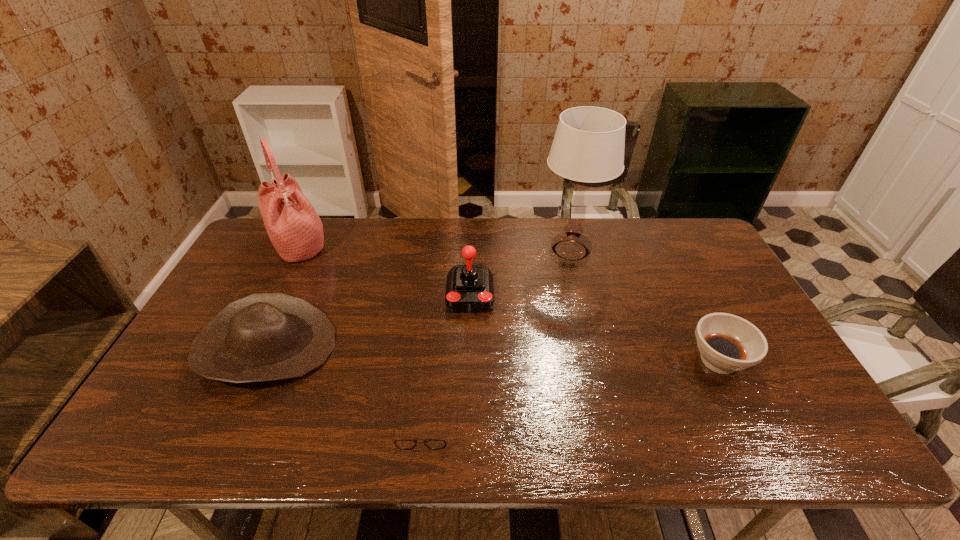
The width and height of the screenshot is (960, 540). I want to click on free spot between the sunglasses and the joystick, so click(447, 359).

This screenshot has width=960, height=540. Identify the location of free space between the rightmost object and the table lamp. (644, 305).

Find the location of a particular element. vacant area that lies between the cowboy hat and the rightmost object is located at coordinates (492, 354).

Where is `free area in between the third tallest object and the rightmost object`? free area in between the third tallest object and the rightmost object is located at coordinates pyautogui.click(x=594, y=328).

You are a GUI agent. You are given a task and a screenshot of the screen. Output one action in this format:
    pyautogui.click(x=<x>, y=<y>)
    Task: Click on the vacant space that is in between the sunglasses and the fourth tallest object
    
    Given the screenshot: What is the action you would take?
    pyautogui.click(x=346, y=384)

Find the location of a particular element. Image resolution: width=960 pixels, height=540 pixels. free spot between the joystick and the third shortest object is located at coordinates (369, 321).

At what (x,y) coordinates should I click in order to perform the action: click on free space between the cowboy hat and the joystick. Please return your answer as a coordinate pair (x, y). The image size is (960, 540). Looking at the image, I should click on (369, 321).

Image resolution: width=960 pixels, height=540 pixels. Identify the location of object that is the fifth closest to the joystick. (727, 343).

Where is `the fourth closest object to the sunglasses`? the fourth closest object to the sunglasses is located at coordinates (295, 229).

The height and width of the screenshot is (540, 960). Identify the location of free space in the image that satisfies the following two spatial constraints: 1. on the front side of the cowboy hat; 2. on the right side of the soup bowl. (261, 360).